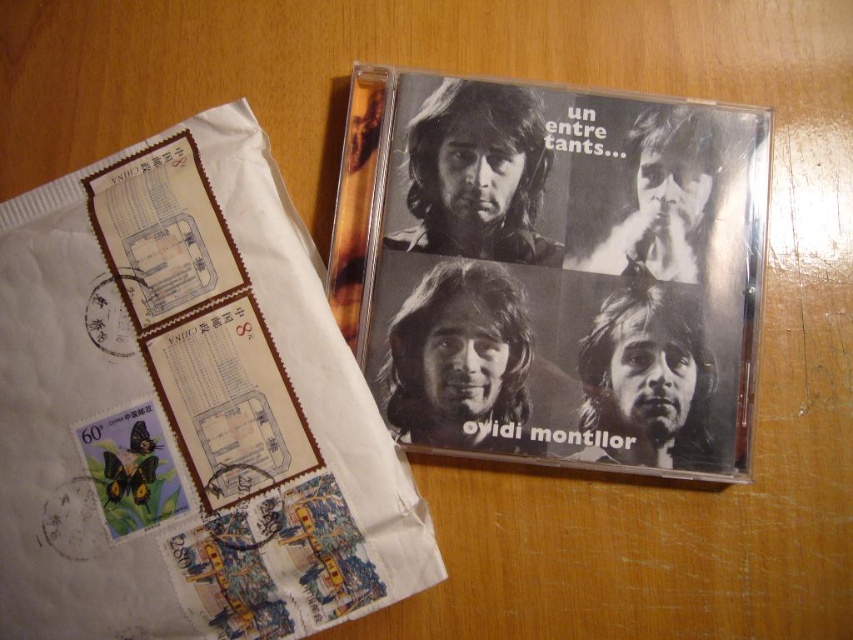
You are organizing items on a shelf and need to place the black matte cd at upper left and the black matte cd at upper right. Since you want to arrange them by size, which one should you place first from left to right?

The black matte cd at upper left is bigger than the black matte cd at upper right, so you should place the black matte cd at upper left first on the left side followed by the smaller one on the right to arrange them from largest to smallest.

You are organizing a music collection and need to place a new CD case that is 5 inches wide between the black matte cd at upper left and the black matte cd at upper right. Can you fit it in the space between them?

The distance between the black matte cd at upper left and the black matte cd at upper right is 7.78 inches. Since the new CD case is 5 inches wide, there is enough space to fit it between them.